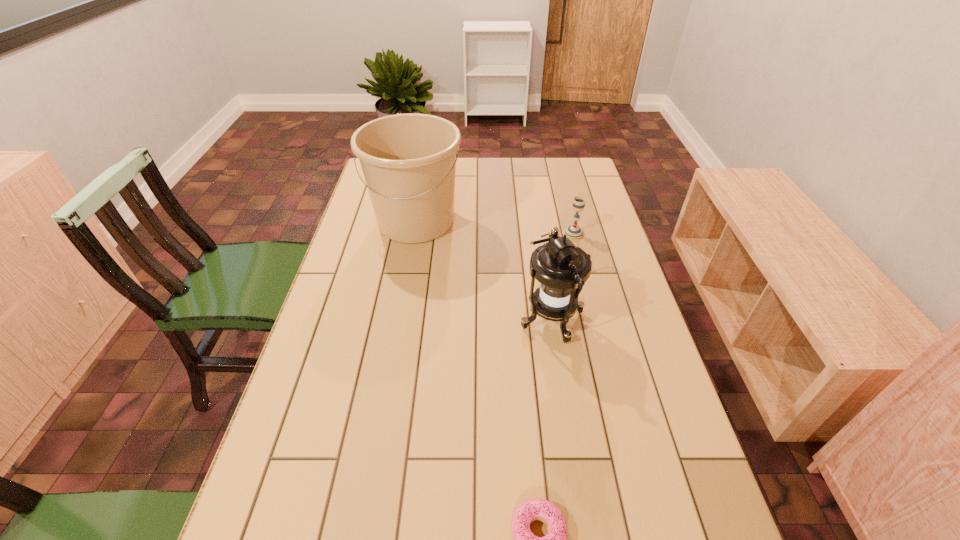
Identify the location of the leftmost object. (408, 160).

This screenshot has width=960, height=540. I want to click on the third farthest object, so click(x=562, y=268).

I want to click on the third tallest object, so click(x=574, y=232).

The width and height of the screenshot is (960, 540). Identify the location of vacant space located on the front of the leftmost object. (406, 273).

At what (x,y) coordinates should I click in order to perform the action: click on vacant space located on the right of the lantern. Please return your answer as a coordinate pair (x, y). The height and width of the screenshot is (540, 960). Looking at the image, I should click on (625, 320).

The image size is (960, 540). What are the coordinates of `vacant space located 0.080m on the front of the third tallest object` in the screenshot? It's located at (580, 256).

Locate an element on the screen. This screenshot has width=960, height=540. object at the left edge is located at coordinates (408, 160).

Image resolution: width=960 pixels, height=540 pixels. I want to click on lantern that is at the right edge, so click(x=562, y=268).

You are a GUI agent. You are given a task and a screenshot of the screen. Output one action in this format:
    pyautogui.click(x=<x>, y=<y>)
    Task: Click on the chalice present at the right edge
    
    Given the screenshot: What is the action you would take?
    pyautogui.click(x=574, y=232)

Where is `free space at the far edge of the desktop`? This screenshot has height=540, width=960. free space at the far edge of the desktop is located at coordinates (527, 168).